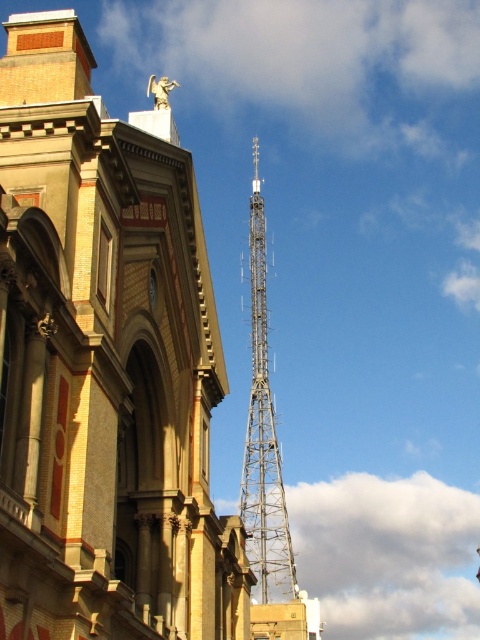
Question: Among these points, which one is nearest to the camera?

Choices:
 (A) (56, 388)
 (B) (250, 276)

Answer: (A)

Question: Observing the image, what is the correct spatial positioning of metallic lattice tower at right in reference to metallic lattice tower at center?

Choices:
 (A) right
 (B) left

Answer: (B)

Question: In this image, where is metallic lattice tower at right located relative to metallic lattice tower at center?

Choices:
 (A) left
 (B) right

Answer: (A)

Question: Is metallic lattice tower at right above metallic lattice tower at center?

Choices:
 (A) yes
 (B) no

Answer: (B)